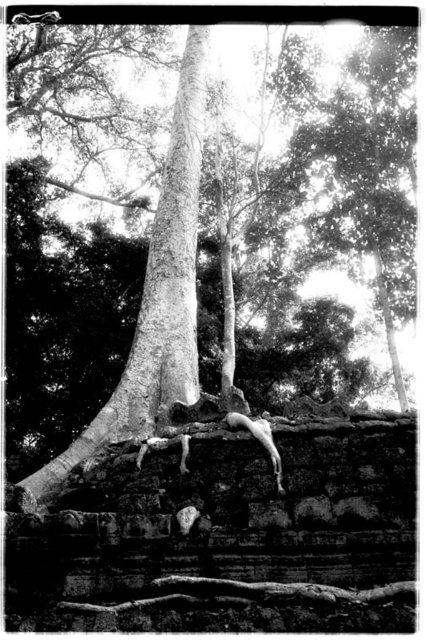
Question: Is smooth bark tree at center below smooth bark tree trunk at center?

Choices:
 (A) no
 (B) yes

Answer: (B)

Question: Is the position of smooth bark tree at center more distant than that of smooth bark tree trunk at center?

Choices:
 (A) yes
 (B) no

Answer: (B)

Question: Which point appears closest to the camera in this image?

Choices:
 (A) (172, 145)
 (B) (184, 180)

Answer: (B)

Question: Does smooth bark tree at center have a larger size compared to smooth bark tree trunk at center?

Choices:
 (A) yes
 (B) no

Answer: (A)

Question: Which of the following is the farthest from the observer?

Choices:
 (A) smooth bark tree trunk at center
 (B) smooth bark tree at center

Answer: (A)